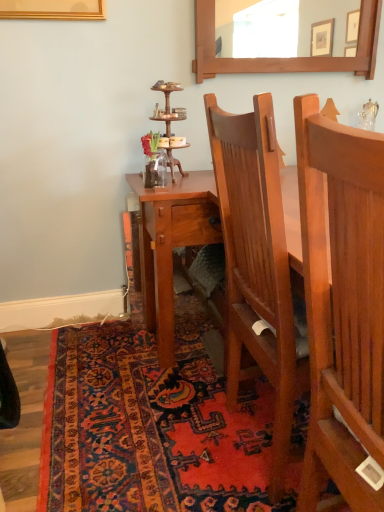
Locate an element on the screen. Image resolution: width=384 pixels, height=512 pixels. light brown wood chair at center is located at coordinates (256, 264).

Where is `carpeted rug at lower center`? The height and width of the screenshot is (512, 384). carpeted rug at lower center is located at coordinates (152, 428).

Which is in front, point (299, 51) or point (278, 424)?

The point (278, 424) is closer.

Could you tell me if wooden mirror at upper center is facing light brown wood chair at center?

No, wooden mirror at upper center is not oriented towards light brown wood chair at center.

Which of these two, wooden mirror at upper center or light brown wood chair at center, is thinner?

Thinner between the two is wooden mirror at upper center.

From the image's perspective, which one is positioned lower, wooden mirror at upper center or light brown wood chair at center?

From the image's view, light brown wood chair at center is below.

Which is in front, point (237, 122) or point (106, 395)?

The point (237, 122) is closer to the camera.

From the image's perspective, which one is positioned higher, light brown wood chair at center or carpeted rug at lower center?

light brown wood chair at center appears higher in the image.

Based on the photo, would you say carpeted rug at lower center is part of light brown wood chair at center's contents?

No, carpeted rug at lower center is not a part of light brown wood chair at center.

Based on the photo, is light brown wood chair at center wider than carpeted rug at lower center?

No.

Is carpeted rug at lower center bigger or smaller than light brown wood chair at center?

carpeted rug at lower center is smaller than light brown wood chair at center.

Relative to light brown wood chair at center, is carpeted rug at lower center in front or behind?

carpeted rug at lower center is behind light brown wood chair at center.

From the image's perspective, which is above, carpeted rug at lower center or light brown wood chair at center?

From the image's view, light brown wood chair at center is above.

Which object is closer to the camera taking this photo, wooden mirror at upper center or carpeted rug at lower center?

carpeted rug at lower center is more forward.

From the image's perspective, is wooden mirror at upper center located beneath carpeted rug at lower center?

Actually, wooden mirror at upper center appears above carpeted rug at lower center in the image.

Can you confirm if wooden mirror at upper center is positioned to the left of carpeted rug at lower center?

No.

Is wooden mirror at upper center looking in the opposite direction of carpeted rug at lower center?

That's not correct — wooden mirror at upper center is not looking away from carpeted rug at lower center.

Which is behind, point (271, 116) or point (259, 7)?

The point (259, 7) is behind.

Visually, is light brown wood chair at center positioned to the left or to the right of wooden mirror at upper center?

Clearly, light brown wood chair at center is on the left of wooden mirror at upper center in the image.

Is light brown wood chair at center taller or shorter than wooden mirror at upper center?

In the image, light brown wood chair at center appears to be taller than wooden mirror at upper center.

From the image's perspective, would you say light brown wood chair at center is shown under wooden mirror at upper center?

Yes.

From the picture: From the image's perspective, which is above, carpeted rug at lower center or wooden mirror at upper center?

wooden mirror at upper center appears higher in the image.

From a real-world perspective, is carpeted rug at lower center above or below wooden mirror at upper center?

carpeted rug at lower center is below wooden mirror at upper center.

The width and height of the screenshot is (384, 512). I want to click on mirror above the carpeted rug at lower center (from a real-world perspective), so click(x=283, y=20).

Can you confirm if carpeted rug at lower center is taller than wooden mirror at upper center?

In fact, carpeted rug at lower center may be shorter than wooden mirror at upper center.

Locate an element on the screen. The width and height of the screenshot is (384, 512). chair below the wooden mirror at upper center (from a real-world perspective) is located at coordinates (256, 264).

Find the location of a particular element. The image size is (384, 512). chair above the carpeted rug at lower center (from the image's perspective) is located at coordinates (256, 264).

Estimate the real-world distances between objects in this image. Which object is closer to light brown wood chair at center, wooden mirror at upper center or carpeted rug at lower center?

Among the two, carpeted rug at lower center is located nearer to light brown wood chair at center.

Which object lies nearer to the anchor point light brown wood chair at center, carpeted rug at lower center or wooden mirror at upper center?

The object closer to light brown wood chair at center is carpeted rug at lower center.

Considering their positions, is wooden mirror at upper center positioned further to carpeted rug at lower center than light brown wood chair at center?

Among the two, wooden mirror at upper center is located further to carpeted rug at lower center.

Looking at the image, which one is located closer to wooden mirror at upper center, light brown wood chair at center or carpeted rug at lower center?

light brown wood chair at center.

Looking at this image, looking at the image, which one is located further to wooden mirror at upper center, carpeted rug at lower center or light brown wood chair at center?

carpeted rug at lower center.

Which object lies further to the anchor point carpeted rug at lower center, light brown wood chair at center or wooden mirror at upper center?

wooden mirror at upper center.

This screenshot has height=512, width=384. I want to click on chair between wooden mirror at upper center and carpeted rug at lower center in the vertical direction, so click(256, 264).